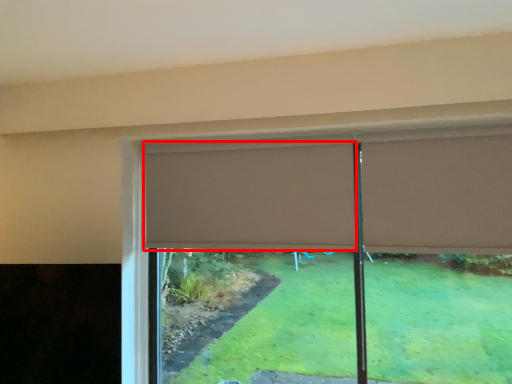
Question: Where is curtain (annotated by the red box) located in relation to curtain in the image?

Choices:
 (A) left
 (B) right

Answer: (A)